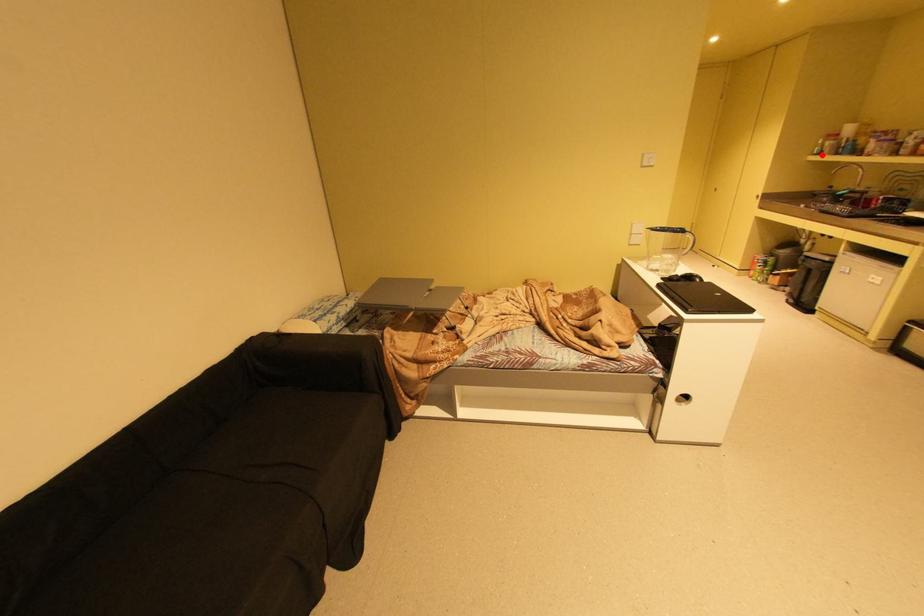
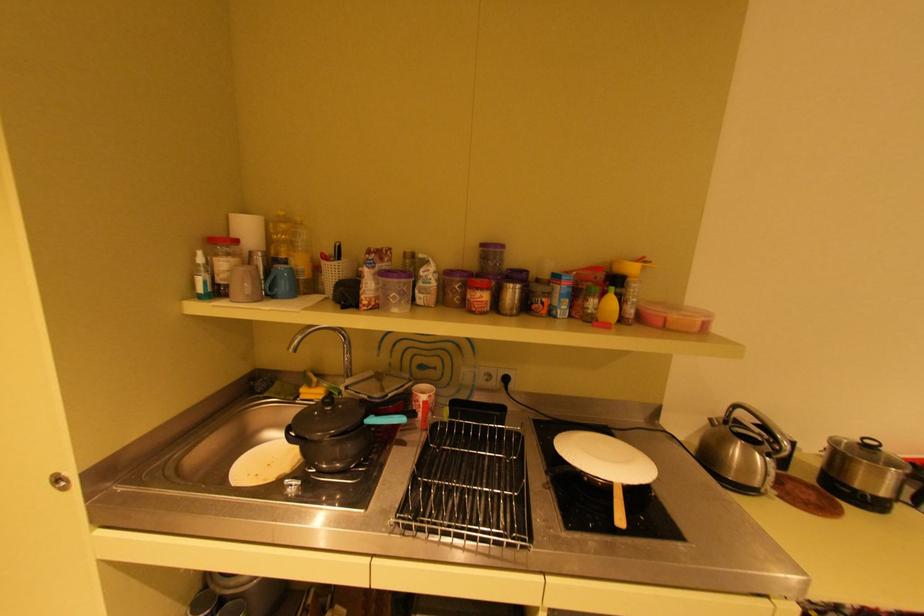
Where in the second image is the point corresponding to the highlighted location from the first image?

(208, 297)